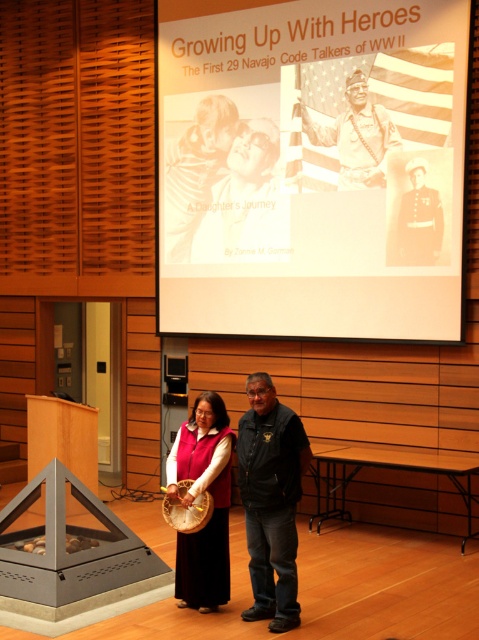
Question: Is the position of black leather jacket at center less distant than that of silvery metallic helmet at upper center?

Choices:
 (A) yes
 (B) no

Answer: (A)

Question: Which object is positioned closest to the black leather jacket at center?

Choices:
 (A) silvery metallic helmet at upper center
 (B) white paper at upper center
 (C) wooden banjo at center
 (D) velvet red vest at center

Answer: (D)

Question: Does black leather jacket at center appear over velvet red vest at center?

Choices:
 (A) yes
 (B) no

Answer: (A)

Question: Among these objects, which one is nearest to the camera?

Choices:
 (A) black leather jacket at center
 (B) silvery metallic helmet at upper center
 (C) white paper at upper center

Answer: (A)

Question: Is white paper at upper center positioned in front of velvet red vest at center?

Choices:
 (A) no
 (B) yes

Answer: (A)

Question: Which object appears farthest from the camera in this image?

Choices:
 (A) white paper at upper center
 (B) black leather jacket at center
 (C) silvery metallic helmet at upper center

Answer: (C)